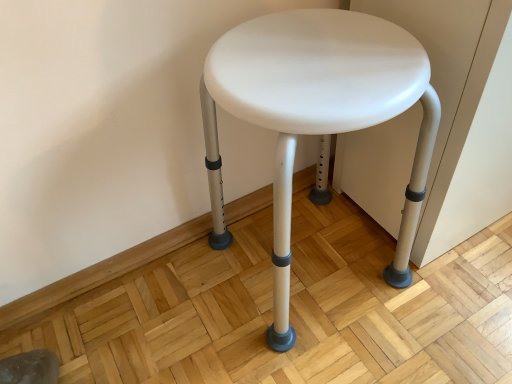
Question: Can you confirm if white plastic stool at center is taller than white plastic stool at center?

Choices:
 (A) no
 (B) yes

Answer: (A)

Question: From a real-world perspective, is white plastic stool at center on top of white plastic stool at center?

Choices:
 (A) no
 (B) yes

Answer: (A)

Question: Is white plastic stool at center to the left of white plastic stool at center from the viewer's perspective?

Choices:
 (A) yes
 (B) no

Answer: (A)

Question: Is white plastic stool at center oriented away from white plastic stool at center?

Choices:
 (A) yes
 (B) no

Answer: (B)

Question: Could white plastic stool at center be considered to be inside white plastic stool at center?

Choices:
 (A) no
 (B) yes

Answer: (A)

Question: Are white plastic stool at center and white plastic stool at center located far from each other?

Choices:
 (A) no
 (B) yes

Answer: (A)

Question: Can you confirm if white plastic stool at center is shorter than white plastic stool at center?

Choices:
 (A) no
 (B) yes

Answer: (A)

Question: Is white plastic stool at center at the left side of white plastic stool at center?

Choices:
 (A) no
 (B) yes

Answer: (A)

Question: From the image's perspective, is white plastic stool at center over white plastic stool at center?

Choices:
 (A) yes
 (B) no

Answer: (A)

Question: From the image's perspective, is white plastic stool at center beneath white plastic stool at center?

Choices:
 (A) yes
 (B) no

Answer: (B)

Question: Can you confirm if white plastic stool at center is wider than white plastic stool at center?

Choices:
 (A) no
 (B) yes

Answer: (B)

Question: Does white plastic stool at center lie in front of white plastic stool at center?

Choices:
 (A) no
 (B) yes

Answer: (B)

Question: Is white plastic stool at center situated inside white plastic stool at center or outside?

Choices:
 (A) inside
 (B) outside

Answer: (B)